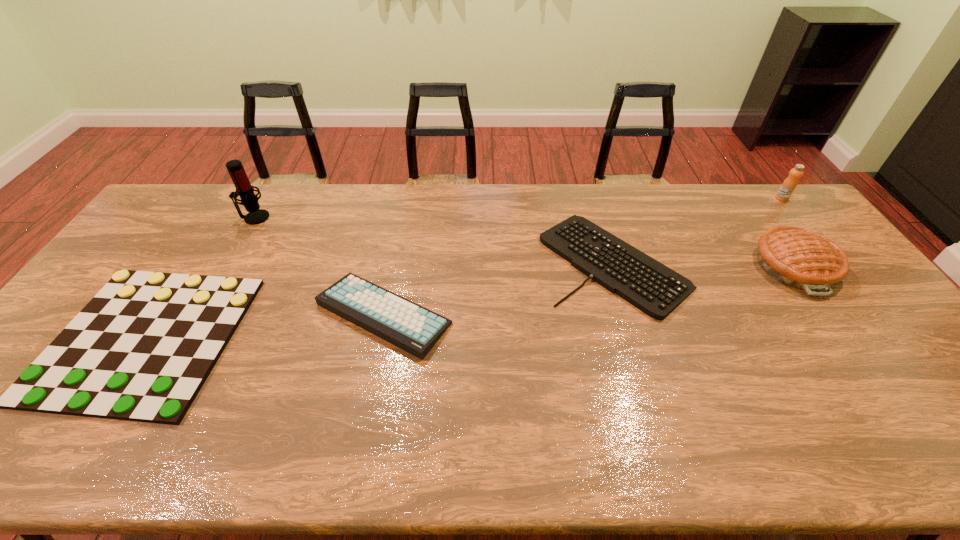
You are a GUI agent. You are given a task and a screenshot of the screen. Output one action in this format:
    pyautogui.click(x=<x>, y=<y>)
    Task: Click on the vacant space positioned 0.270m on the front of the fourth shortest object
    The image size is (960, 540).
    Given the screenshot: What is the action you would take?
    pyautogui.click(x=878, y=384)

Find the location of a particular element. The height and width of the screenshot is (540, 960). free space located on the left of the taller computer keyboard is located at coordinates (176, 314).

Where is `vacant position located on the left of the third object from right to left`? The image size is (960, 540). vacant position located on the left of the third object from right to left is located at coordinates (523, 262).

The image size is (960, 540). What are the coordinates of `microphone that is at the far edge` in the screenshot? It's located at (249, 200).

I want to click on orange juice located at the far edge, so click(790, 183).

Identify the location of computer keyboard located in the far edge section of the desktop. This screenshot has width=960, height=540. (655, 289).

Find the location of `orange juice positioned at the right edge`. orange juice positioned at the right edge is located at coordinates (790, 183).

At what (x,y) coordinates should I click in order to perform the action: click on pie located at the right edge. Please return your answer as a coordinate pair (x, y). Looking at the image, I should click on (799, 258).

You are a GUI agent. You are given a task and a screenshot of the screen. Output one action in this format:
    pyautogui.click(x=<x>, y=<y>)
    Task: Click on the object located in the far right corner section of the desktop
    The image size is (960, 540).
    Given the screenshot: What is the action you would take?
    pyautogui.click(x=790, y=183)

In the image, there is a desktop. At what (x,y) coordinates should I click in order to perform the action: click on vacant area at the far edge. Please return your answer as a coordinate pair (x, y). Looking at the image, I should click on (x=564, y=213).